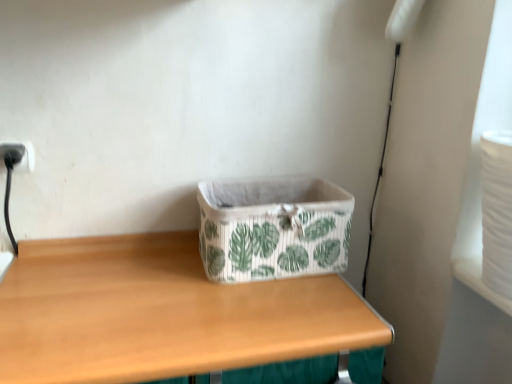
Question: Is wooden table at center taller or shorter than black plastic electric outlet at upper left?

Choices:
 (A) short
 (B) tall

Answer: (B)

Question: From the image's perspective, is wooden table at center located above or below black plastic electric outlet at upper left?

Choices:
 (A) above
 (B) below

Answer: (B)

Question: Estimate the real-world distances between objects in this image. Which object is closer to the black plastic electric outlet at upper left?

Choices:
 (A) white fabric storage box at center
 (B) wooden table at center

Answer: (B)

Question: Which is farther from the wooden table at center?

Choices:
 (A) white fabric storage box at center
 (B) black plastic electric outlet at upper left

Answer: (B)